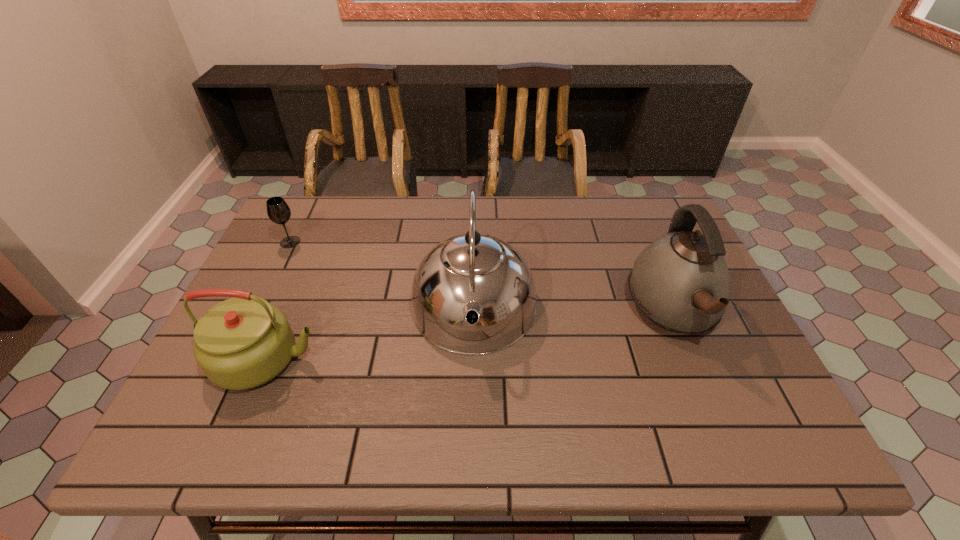
Locate an element on the screen. free point located 0.140m on the right of the farthest object is located at coordinates click(347, 242).

Identify the location of object positioned at the far edge. The height and width of the screenshot is (540, 960). (278, 211).

Locate an element on the screen. kettle that is at the left edge is located at coordinates (241, 343).

Image resolution: width=960 pixels, height=540 pixels. I want to click on wineglass that is at the left edge, so click(278, 211).

Where is `object situated at the right edge`? The height and width of the screenshot is (540, 960). object situated at the right edge is located at coordinates (681, 282).

The image size is (960, 540). I want to click on object that is positioned at the far left corner, so click(x=278, y=211).

Image resolution: width=960 pixels, height=540 pixels. I want to click on free space at the far edge of the desktop, so click(x=520, y=233).

This screenshot has height=540, width=960. In order to click on free space at the near edge in this screenshot , I will do pyautogui.click(x=408, y=442).

In order to click on free location at the left edge in this screenshot , I will do `click(290, 277)`.

Find the location of a particular element. free spot at the right edge of the desktop is located at coordinates (698, 362).